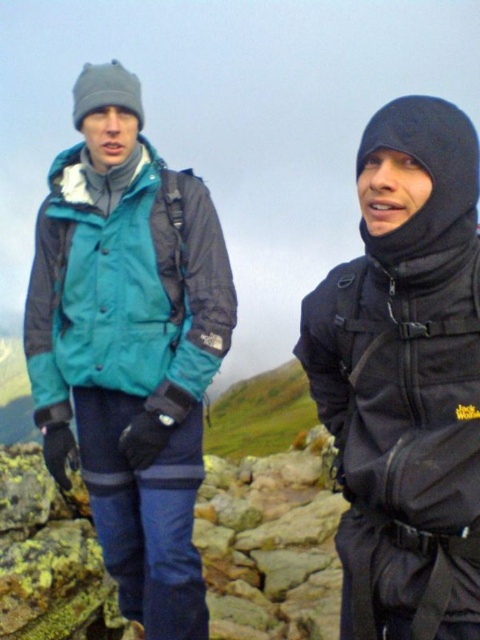
In the scene shown: You are planning to buy a jacket for a cold mountain hike. You see two jackets in the image, the black softshell jacket at right and the teal fabric jacket at left. Which jacket would you choose if you want a larger size?

The black softshell jacket at right is larger in size than the teal fabric jacket at left, so you should choose the black softshell jacket at right for a larger size.

Consider the image. You are a hiker trying to navigate between two points marked on your map. The first point is at coordinates point (327, 392) and the second point is at coordinates point (132, 243). Which point is closer to your current position if you are standing at the starting point?

Point (327, 392) is in front of point (132, 243), so it is closer to your current position.

You are a hiker planning to cross a narrow mountain path. You see two hikers ahead of you on the trail. One is wearing the black softshell jacket at right and the other the teal fabric jacket at left. Which hiker is standing closer to the edge of the path based on their jacket sizes?

The black softshell jacket at right is much taller than the teal fabric jacket at left, so the hiker in the black softshell jacket at right is standing closer to the edge of the path.